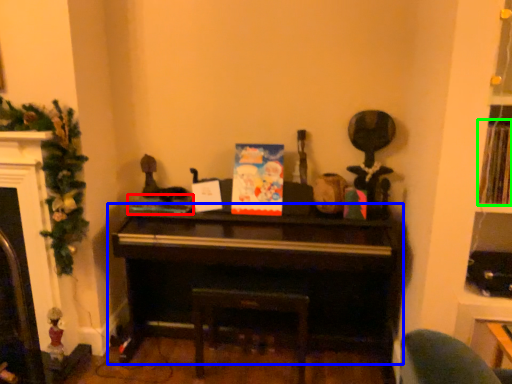
Question: Which object is the farthest from book (highlighted by a red box)? Choose among these: piano (highlighted by a blue box) or book (highlighted by a green box).

Choices:
 (A) piano
 (B) book

Answer: (B)